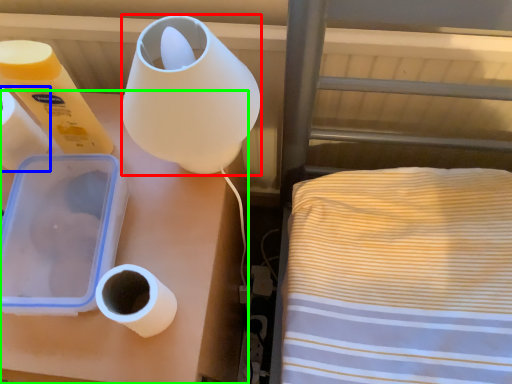
Question: Based on their relative distances, which object is farther from lamp (highlighted by a red box)? Choose from paper towel (highlighted by a blue box) and furniture (highlighted by a green box).

Choices:
 (A) paper towel
 (B) furniture

Answer: (A)